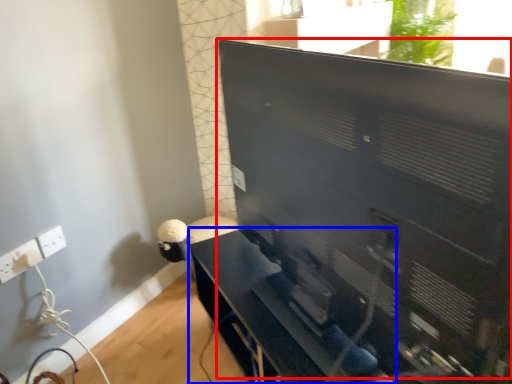
Question: Which of the following is the farthest to the observer, computer monitor (highlighted by a red box) or furniture (highlighted by a blue box)?

Choices:
 (A) computer monitor
 (B) furniture

Answer: (B)